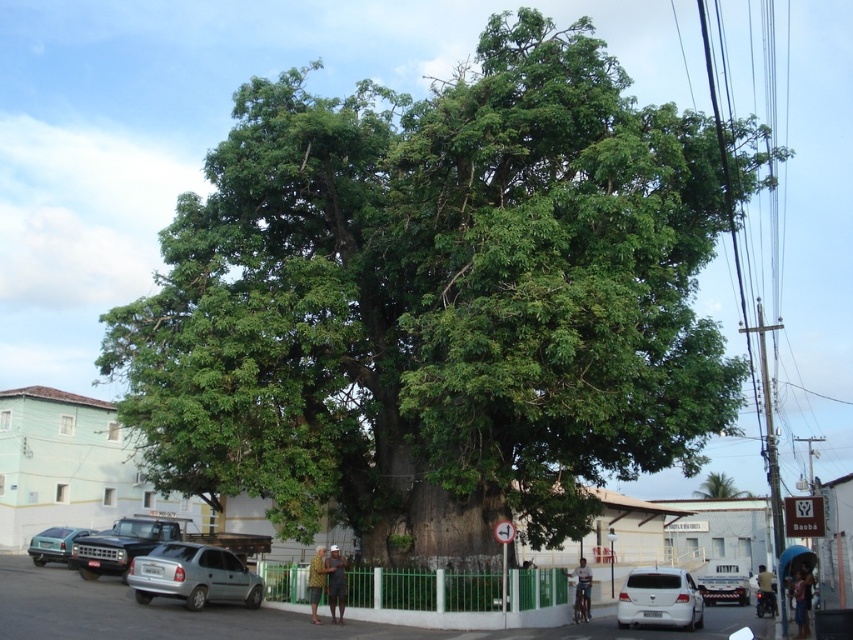
Question: Among these objects, which one is nearest to the camera?

Choices:
 (A) white matte van at lower right
 (B) matte black truck at left
 (C) green leafy tree at center
 (D) metallic silver sedan at lower left

Answer: (A)

Question: Considering the relative positions of silver metallic hatchback at lower left and matte black truck at left in the image provided, where is silver metallic hatchback at lower left located with respect to matte black truck at left?

Choices:
 (A) right
 (B) left

Answer: (A)

Question: Is silver metallic hatchback at lower left below metallic silver sedan at lower left?

Choices:
 (A) yes
 (B) no

Answer: (B)

Question: Which object appears closest to the camera in this image?

Choices:
 (A) white matte van at lower right
 (B) green leafy tree at center

Answer: (A)

Question: Can you confirm if silver metallic hatchback at lower left is positioned below matte black truck at left?

Choices:
 (A) no
 (B) yes

Answer: (A)

Question: Among these points, which one is nearest to the camera?

Choices:
 (A) (74, 545)
 (B) (720, 484)

Answer: (A)